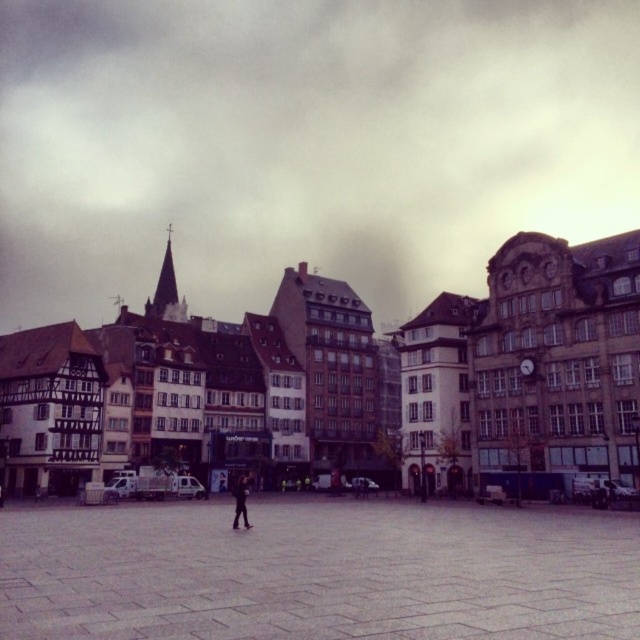
You are standing in the town square and want to sit down to rest. The gray stone pavement at center and the dark gray fabric jacket at center are both in your view. Which one is larger in size?

The gray stone pavement at center is bigger than the dark gray fabric jacket at center, so the gray stone pavement at center is larger in size.